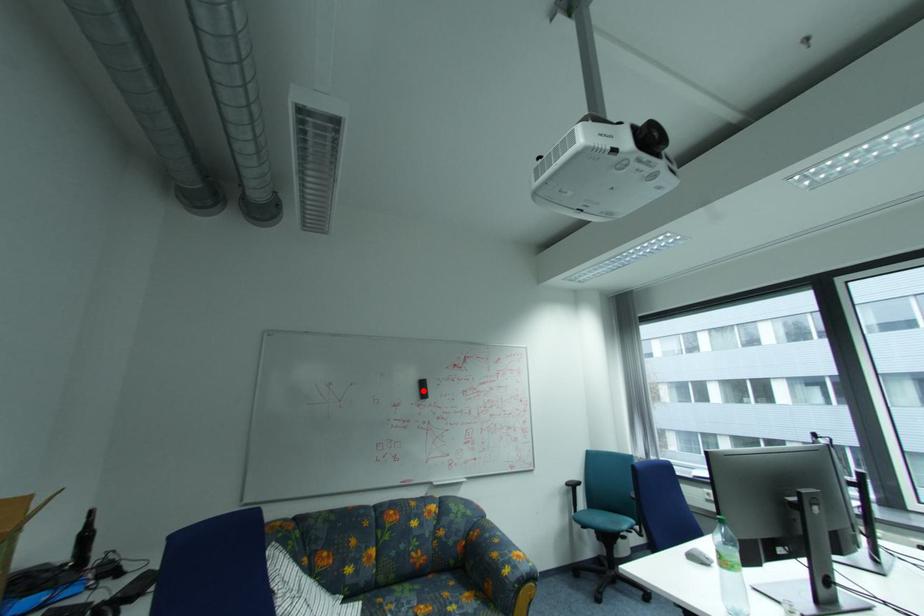
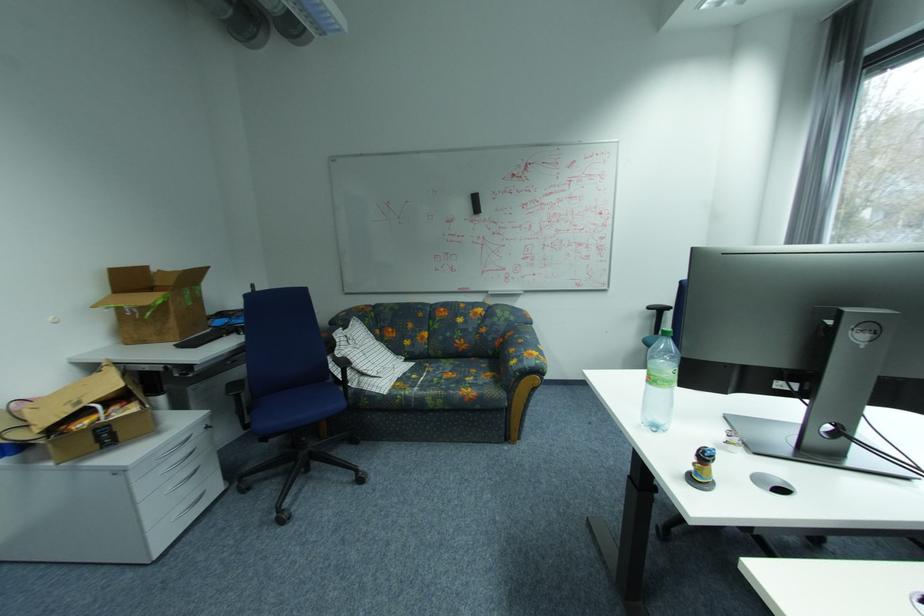
In the second image, find the point that corresponds to the highlighted location in the first image.

(476, 206)